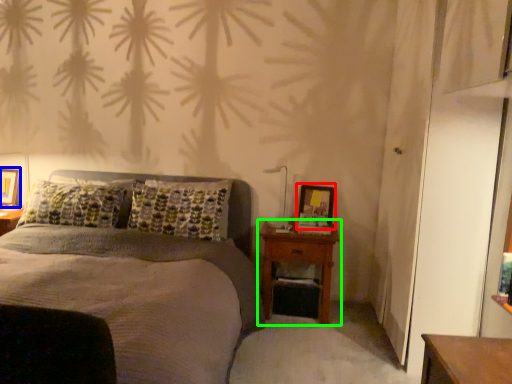
Question: Which is nearer to the picture frame (highlighted by a red box)? picture frame (highlighted by a blue box) or nightstand (highlighted by a green box).

Choices:
 (A) picture frame
 (B) nightstand

Answer: (B)